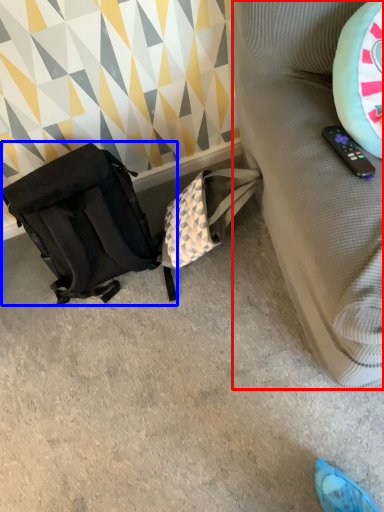
Question: Which point is further to the camera, furniture (highlighted by a red box) or luggage and bags (highlighted by a blue box)?

Choices:
 (A) furniture
 (B) luggage and bags

Answer: (B)